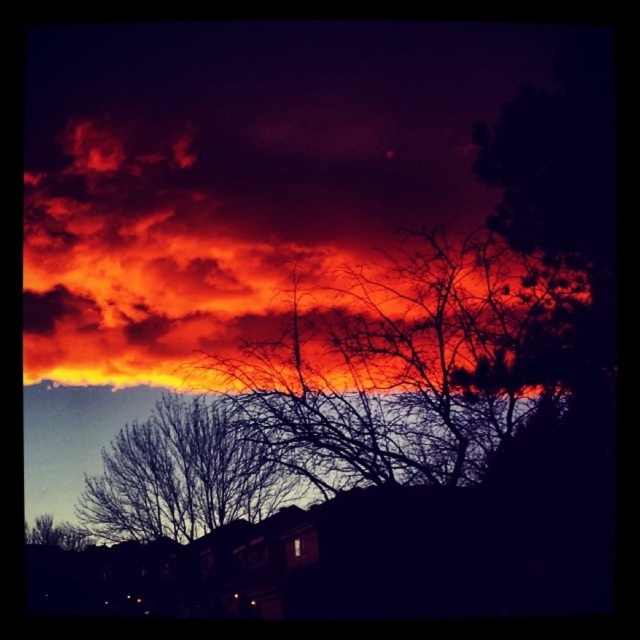
Question: Which point is farther to the camera?

Choices:
 (A) fiery orange cloud at upper center
 (B) silhouette bare branches at center
 (C) silhouette bare tree at lower left

Answer: (A)

Question: Is bare branches at center further to the viewer compared to silhouette bare tree at lower left?

Choices:
 (A) yes
 (B) no

Answer: (A)

Question: Can you confirm if fiery orange cloud at upper center is positioned above silhouette bare tree at lower left?

Choices:
 (A) no
 (B) yes

Answer: (B)

Question: Among these points, which one is nearest to the camera?

Choices:
 (A) (156, 250)
 (B) (28, 525)
 (C) (275, 460)

Answer: (B)

Question: Is silhouette bare branches at center to the left of bare branches at center from the viewer's perspective?

Choices:
 (A) yes
 (B) no

Answer: (B)

Question: Which of the following is the closest to the observer?

Choices:
 (A) (227, 488)
 (B) (44, 515)
 (C) (291, 260)

Answer: (A)